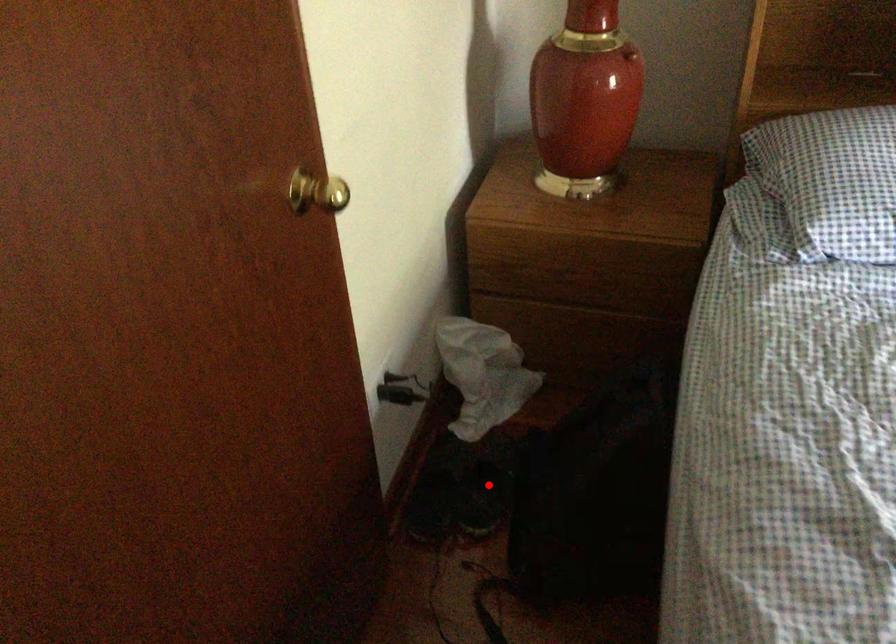
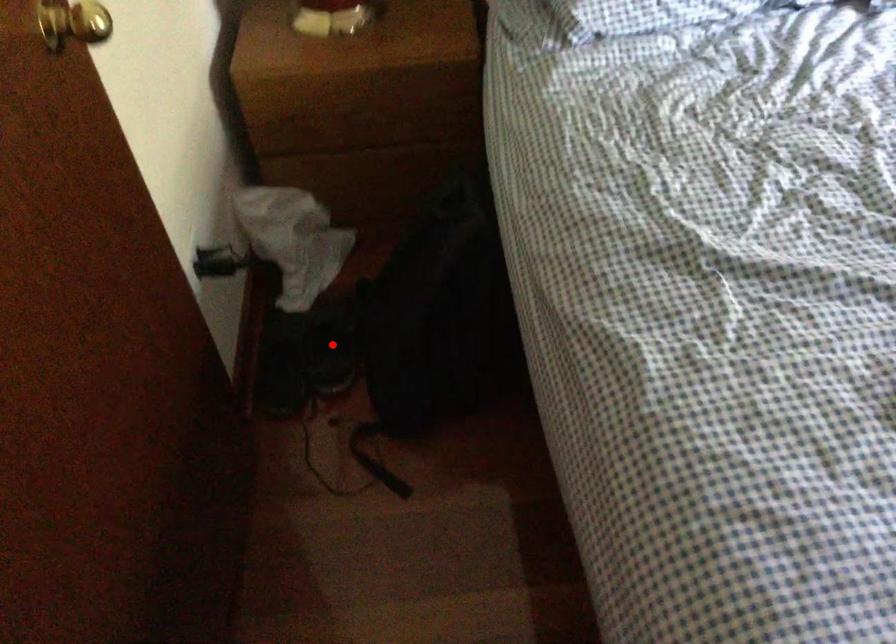
I am providing you with two images of the same scene from different viewpoints. A red point is marked on the first image and another point is marked on the second image. Is the red point in image1 aligned with the point shown in image2?

Yes